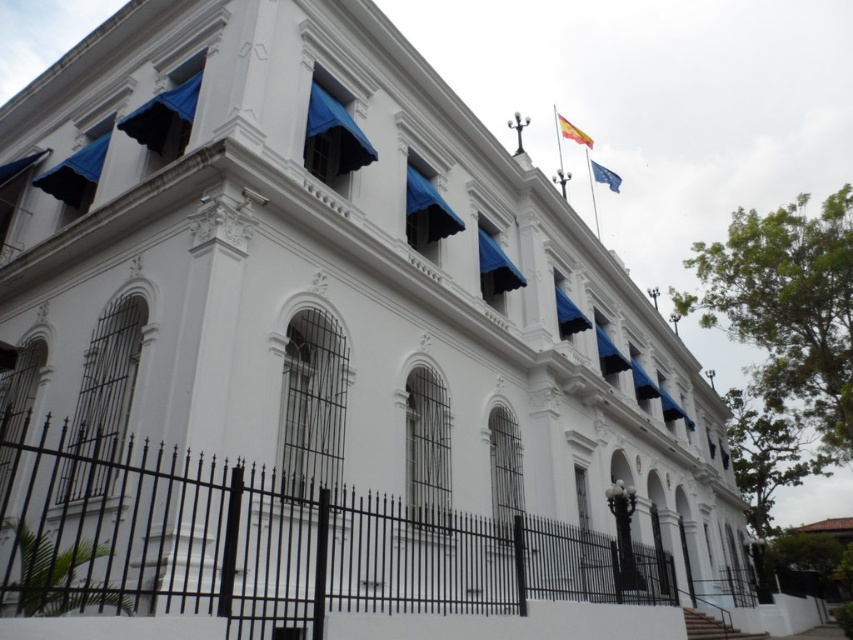
Question: Which point appears farthest from the camera in this image?

Choices:
 (A) (616, 173)
 (B) (13, 456)
 (C) (585, 145)

Answer: (A)

Question: Can you confirm if black wrought iron fence at lower center is positioned above yellow fabric flag at upper center?

Choices:
 (A) no
 (B) yes

Answer: (A)

Question: Which point is closer to the camera?

Choices:
 (A) black wrought iron fence at lower center
 (B) yellow fabric flag at upper center
 (C) blue fabric flag at upper center

Answer: (A)

Question: Is the position of black wrought iron fence at lower center more distant than that of blue fabric flag at upper center?

Choices:
 (A) yes
 (B) no

Answer: (B)

Question: Which object is positioned farthest from the blue fabric flag at upper center?

Choices:
 (A) black wrought iron fence at lower center
 (B) yellow fabric flag at upper center

Answer: (A)

Question: Does black wrought iron fence at lower center have a lesser width compared to blue fabric flag at upper center?

Choices:
 (A) no
 (B) yes

Answer: (A)